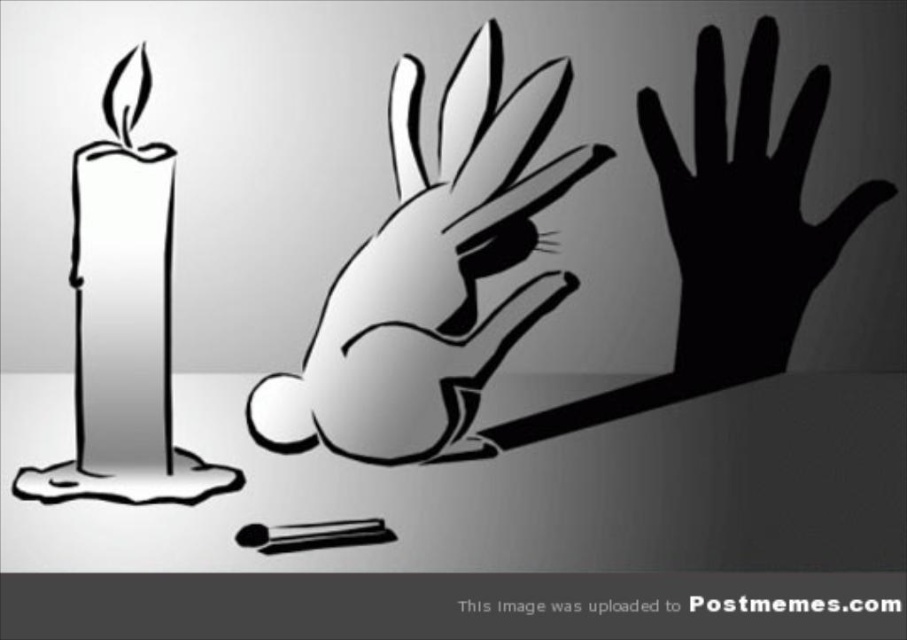
You are an artist trying to draw this scene. You want to ensure the shiny silver bunny at center and the white matte candle at left are proportionally accurate. Which object should you draw taller?

The shiny silver bunny at center should be drawn taller since it has a greater height compared to the white matte candle at left according to the description.

You are an artist analyzing the composition of this monochromatic illustration. The scene includes a candle, a rabbit, and the black shadow hand at right. Based on their positions, which object is located closest to the bottom edge of the image?

The black shadow hand at right is located closest to the bottom edge of the image because its 2D coordinates are at point (x=745, y=212), which places it lower than the other objects.

From the picture: You are an artist trying to draw this scene. You want to ensure the shiny silver bunny at center and the white matte candle at left are proportionally accurate. Which object should you draw larger?

The shiny silver bunny at center should be drawn larger because it is bigger than the white matte candle at left according to the description.